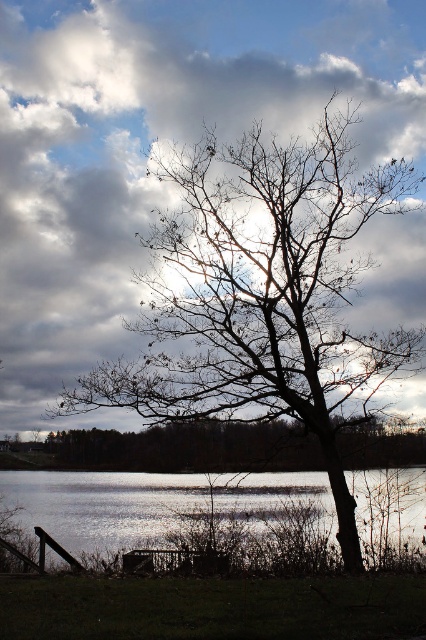
Can you confirm if bare branches at center is positioned to the right of silvery reflective water at lower center?

In fact, bare branches at center is to the left of silvery reflective water at lower center.

From the picture: Who is lower down, bare branches at center or silvery reflective water at lower center?

silvery reflective water at lower center

Is point (293, 198) closer to camera compared to point (216, 486)?

Yes, it is in front of point (216, 486).

This screenshot has height=640, width=426. What are the coordinates of `bare branches at center` in the screenshot? It's located at (261, 294).